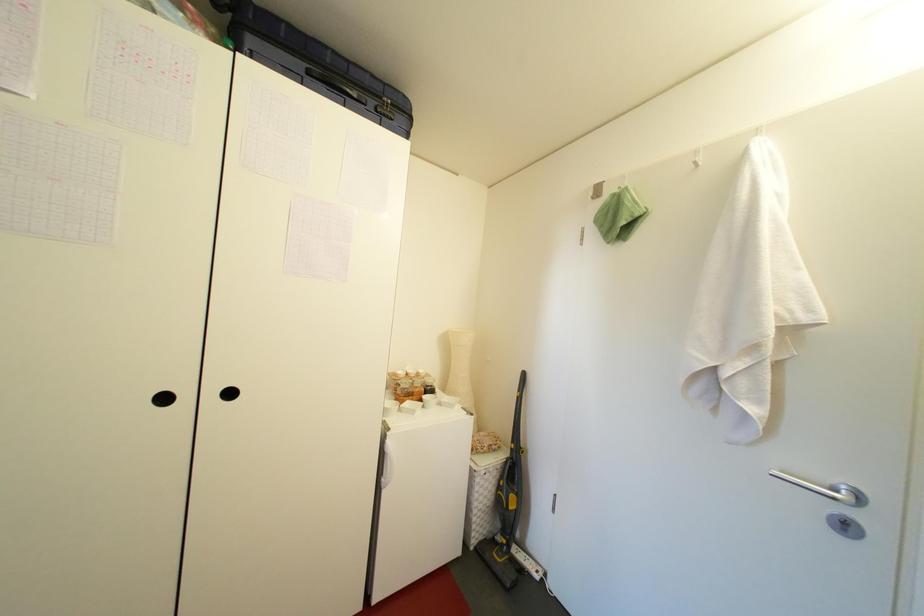
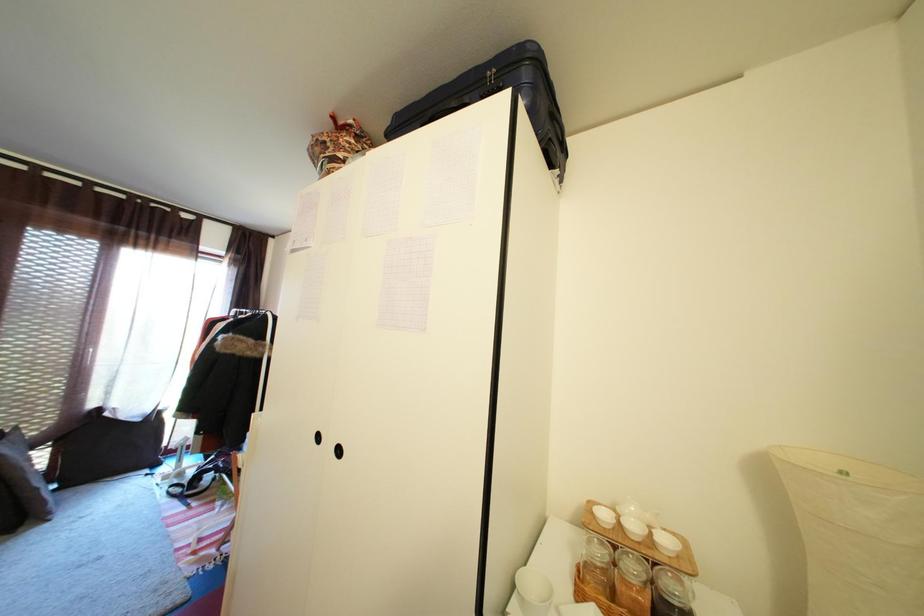
Question: The first image is from the beginning of the video and the second image is from the end. How did the camera likely rotate when shooting the video?

Choices:
 (A) Left
 (B) Right
 (C) Up
 (D) Down

Answer: (A)